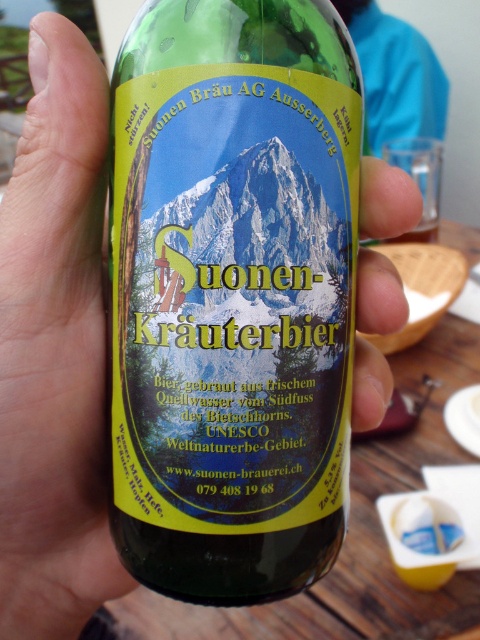
Question: Is green glass bottle at center to the right of transparent plastic bottle at center from the viewer's perspective?

Choices:
 (A) no
 (B) yes

Answer: (B)

Question: Which of the following is the farthest from the observer?

Choices:
 (A) (72, 612)
 (B) (183, 4)

Answer: (A)

Question: Does green glass bottle at center come in front of transparent plastic bottle at center?

Choices:
 (A) no
 (B) yes

Answer: (B)

Question: Can you confirm if green glass bottle at center is positioned to the right of transparent plastic bottle at center?

Choices:
 (A) yes
 (B) no

Answer: (A)